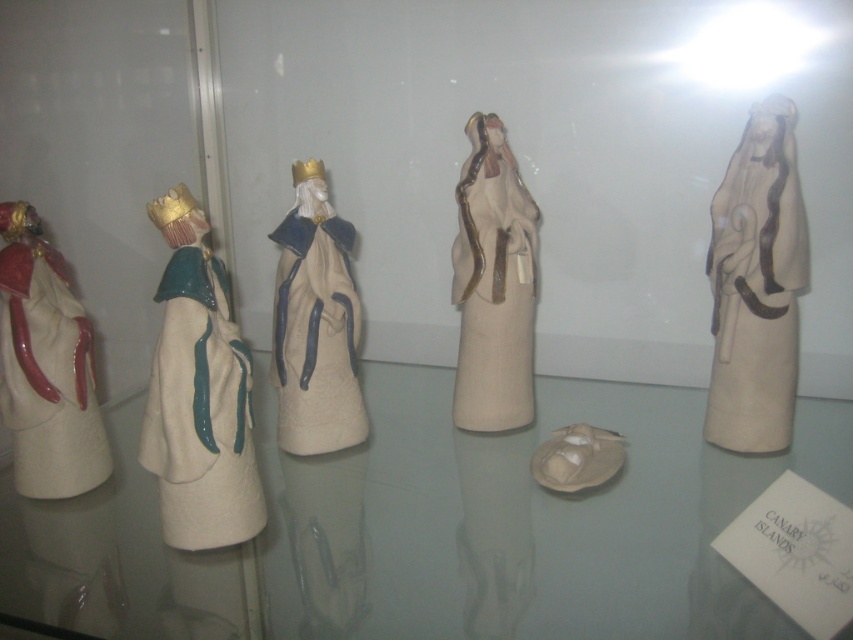
Question: Which point is closer to the camera taking this photo?

Choices:
 (A) (347, 397)
 (B) (746, 131)
 (C) (68, 412)

Answer: (C)

Question: Which of the following is the farthest from the observer?

Choices:
 (A) matte white porcelain figurine at left
 (B) transparent glass table at center
 (C) matte red fabric at left

Answer: (C)

Question: Which is farther from the transparent glass table at center?

Choices:
 (A) matte white porcelain figurine at center
 (B) matte white porcelain figurine at left
 (C) matte red fabric at left
 (D) matte beige figurine at center

Answer: (C)

Question: Is matte white porcelain figurine at left to the right of matte beige statue at right from the viewer's perspective?

Choices:
 (A) yes
 (B) no

Answer: (B)

Question: Does matte red fabric at left have a greater width compared to matte beige figurine at center?

Choices:
 (A) yes
 (B) no

Answer: (B)

Question: Does transparent glass table at center appear on the left side of matte beige figurine at center?

Choices:
 (A) yes
 (B) no

Answer: (A)